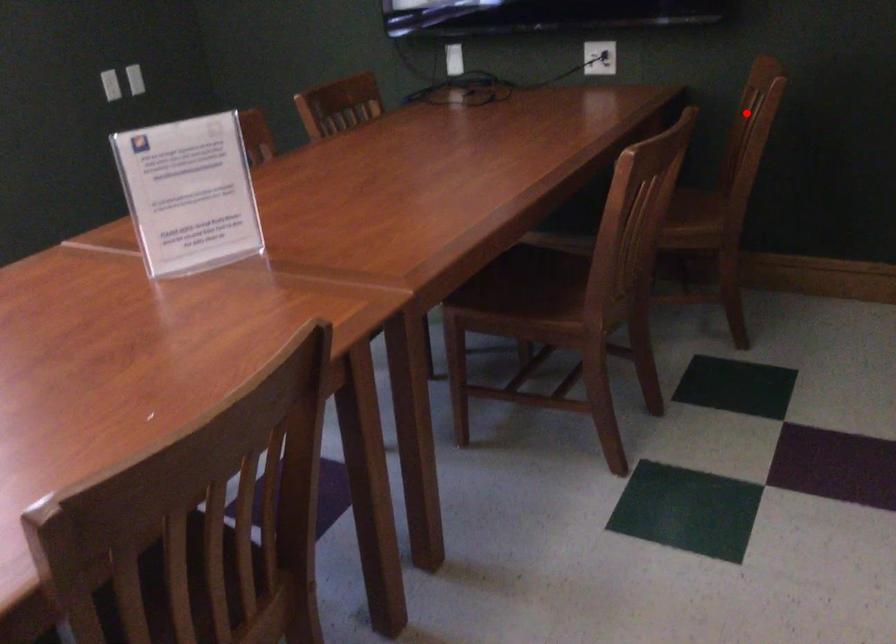
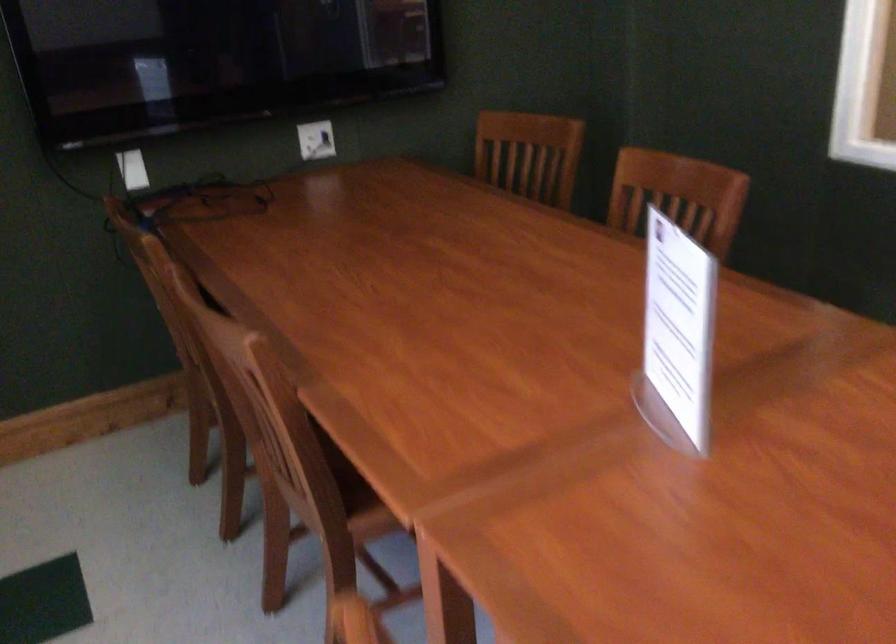
Question: I am providing you with two images of the same scene from different viewpoints. In image1, a red point is highlighted. Considering the same 3D point in image2, which of the following is correct?

Choices:
 (A) It is closer
 (B) It is farther

Answer: (B)